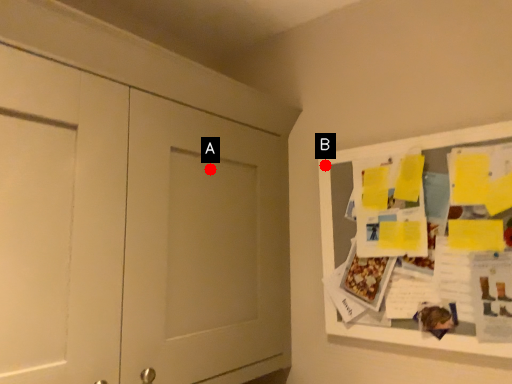
Question: Two points are circled on the image, labeled by A and B beside each circle. Which of the following is the closest to the observer?

Choices:
 (A) A is closer
 (B) B is closer

Answer: (A)